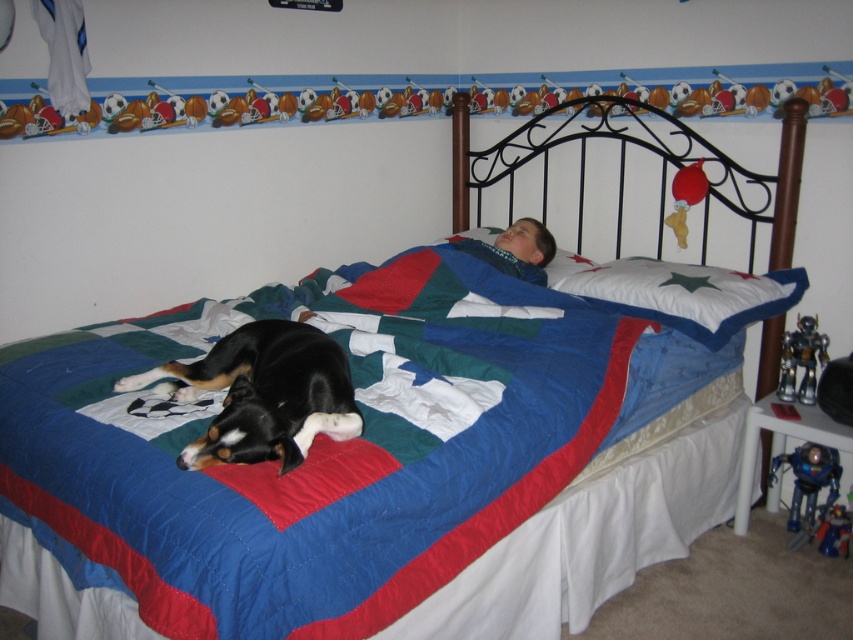
You are standing in the bedroom and want to reach both the point at coordinates point (x=202, y=381) and the point at coordinates point (x=677, y=244). Which point should you target first to minimize the distance walked?

You should target point (x=202, y=381) first since it is closer to you than point (x=677, y=244).